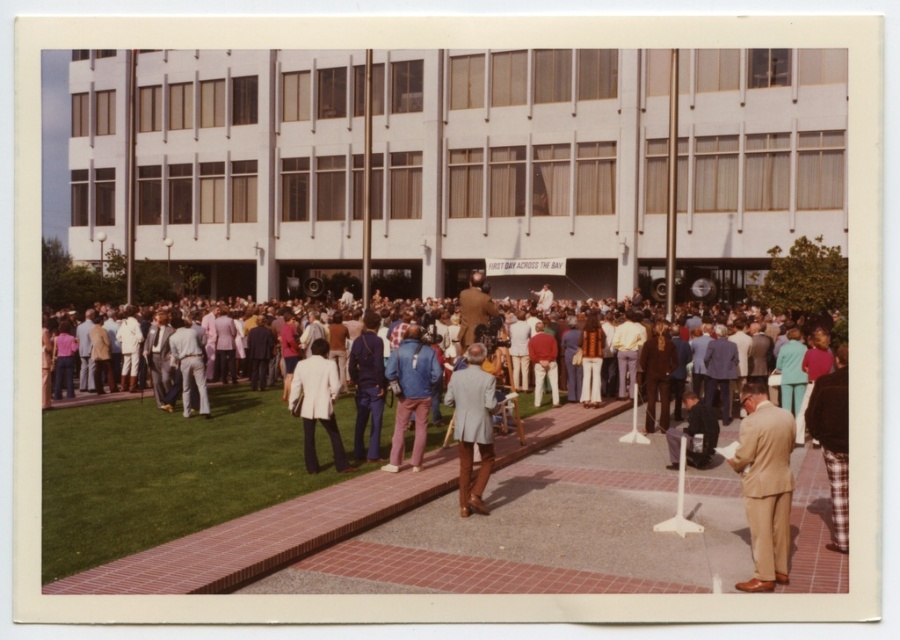
Can you confirm if light gray suit at center is positioned below white textured blazer at center?

Correct, light gray suit at center is located below white textured blazer at center.

Where is `light gray suit at center`? The image size is (900, 640). light gray suit at center is located at coordinates (472, 426).

Does point (744, 428) lie behind point (693, 464)?

No.

Who is taller, tan suit at lower right or dark blue suit at center?

Standing taller between the two is tan suit at lower right.

Identify the location of tan suit at lower right. (765, 484).

Is tan suit at lower right shorter than brown leather jacket at center?

Correct, tan suit at lower right is not as tall as brown leather jacket at center.

Who is positioned more to the right, tan suit at lower right or brown leather jacket at center?

From the viewer's perspective, tan suit at lower right appears more on the right side.

In order to click on tan suit at lower right in this screenshot , I will do `click(765, 484)`.